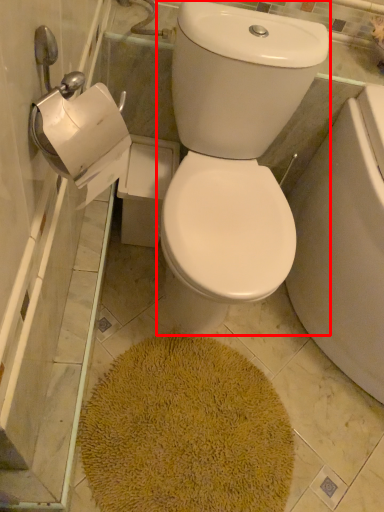
Question: Observing the image, what is the correct spatial positioning of toilet bowl (annotated by the red box) in reference to bath mat?

Choices:
 (A) left
 (B) right

Answer: (B)